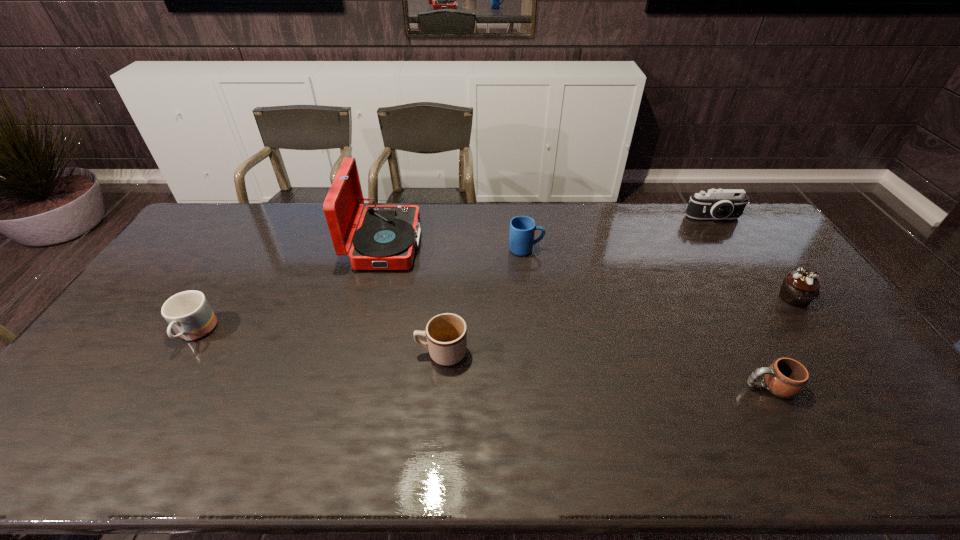
Locate an element on the screen. This screenshot has height=540, width=960. blank region between the farthest mug and the leftmost object is located at coordinates (361, 292).

Identify the location of free space between the farthest mug and the camera. (619, 234).

Find the location of `unoccupied position between the phonograph_record and the farthest mug`. unoccupied position between the phonograph_record and the farthest mug is located at coordinates (455, 247).

The height and width of the screenshot is (540, 960). What are the coordinates of `empty space that is in between the fourth nearest object and the third mug from left to right` in the screenshot? It's located at (660, 274).

You are a GUI agent. You are given a task and a screenshot of the screen. Output one action in this format:
    pyautogui.click(x=<x>, y=<y>)
    Task: Click on the vacant region between the sixth object from right to left and the fourth farthest object
    
    Given the screenshot: What is the action you would take?
    pyautogui.click(x=589, y=271)

Identify the location of free space that is in between the shortest object and the sixth object from right to left. (577, 315).

The image size is (960, 540). What are the coordinates of `vacant area that lies between the cupcake and the fourth object from right to left` in the screenshot? It's located at tap(660, 274).

Where is `vacant space that's between the third object from left to right and the camera`? The height and width of the screenshot is (540, 960). vacant space that's between the third object from left to right and the camera is located at coordinates (578, 286).

I want to click on free space between the tallest object and the fourth object from left to right, so click(x=455, y=247).

Locate an element on the screen. This screenshot has width=960, height=540. free space between the fourth object from left to right and the fourth nearest object is located at coordinates (660, 274).